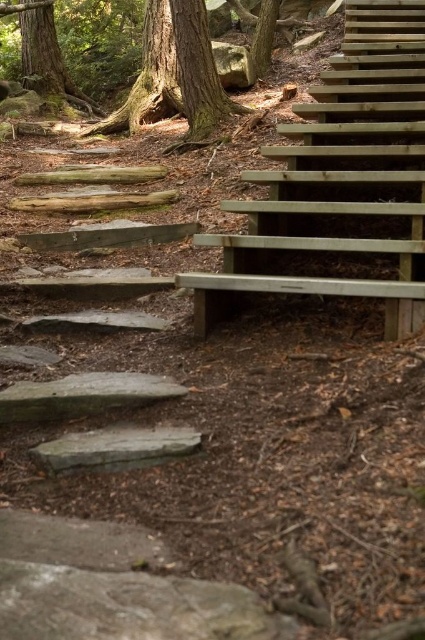
Question: Which point is closer to the camera taking this photo?

Choices:
 (A) (167, 83)
 (B) (215, 301)

Answer: (B)

Question: Can you confirm if wooden stairs at upper right is smaller than green rough bark tree at upper left?

Choices:
 (A) no
 (B) yes

Answer: (A)

Question: In this image, where is wooden stairs at upper right located relative to green rough bark tree at upper left?

Choices:
 (A) below
 (B) above

Answer: (A)

Question: Is wooden stairs at upper right to the left of green rough bark tree at upper left from the viewer's perspective?

Choices:
 (A) yes
 (B) no

Answer: (B)